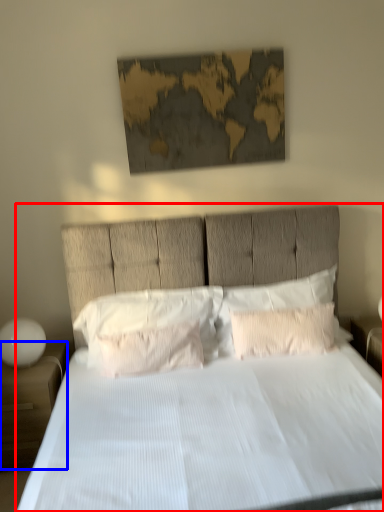
Question: Which object appears farthest to the camera in this image, bed (highlighted by a red box) or nightstand (highlighted by a blue box)?

Choices:
 (A) bed
 (B) nightstand

Answer: (B)